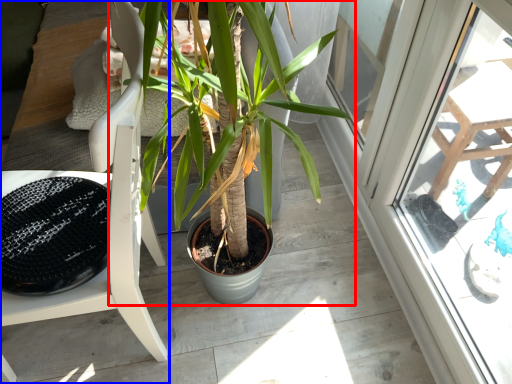
Question: Which of the following is the closest to the observer, houseplant (highlighted by a red box) or chair (highlighted by a blue box)?

Choices:
 (A) houseplant
 (B) chair

Answer: (B)